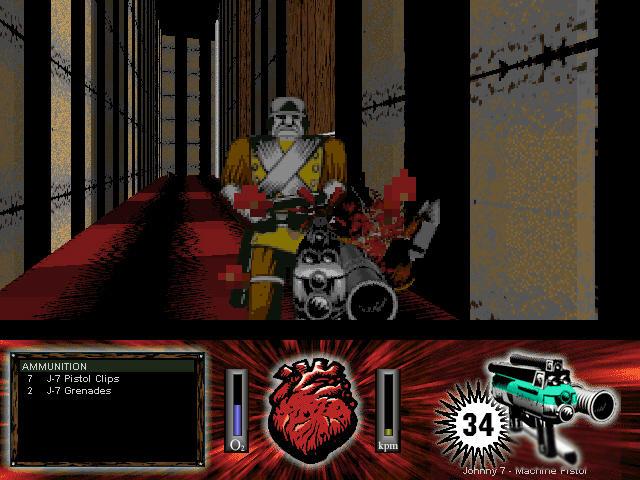
At what (x,y) coordinates should I click in order to perform the action: click on tall walls. Please return your answer as a coordinate pair (x, y). The height and width of the screenshot is (480, 640). Looking at the image, I should click on pyautogui.click(x=525, y=132), pyautogui.click(x=301, y=43), pyautogui.click(x=170, y=117), pyautogui.click(x=52, y=215).